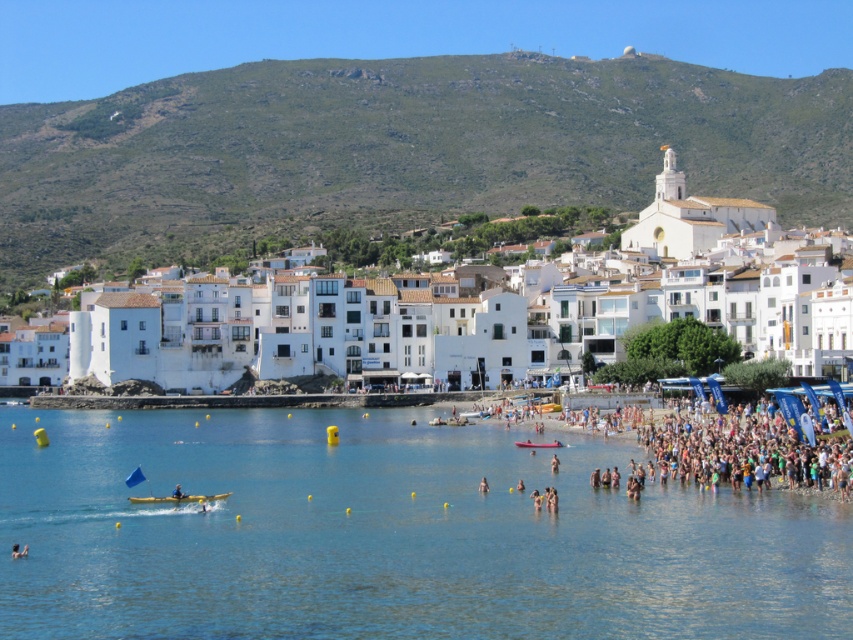
Is white plastic kayak at center thinner than pink rubber boat at center?

No.

Who is more distant from viewer, (224, 492) or (515, 444)?

Positioned behind is point (515, 444).

Image resolution: width=853 pixels, height=640 pixels. Describe the element at coordinates (178, 499) in the screenshot. I see `white plastic kayak at center` at that location.

What are the coordinates of `white plastic kayak at center` in the screenshot? It's located at (178, 499).

Does white plastic kayak at center come in front of skinny person at lower center?

Yes, it is.

Is white plastic kayak at center shorter than skinny person at lower center?

Correct, white plastic kayak at center is not as tall as skinny person at lower center.

Consider the image. Who is more distant from viewer, (x=209, y=496) or (x=485, y=490)?

The point (x=485, y=490) is behind.

At what (x,y) coordinates should I click in order to perform the action: click on white plastic kayak at center. Please return your answer as a coordinate pair (x, y). The image size is (853, 640). Looking at the image, I should click on (178, 499).

Which is more to the right, green grassy hillside at upper center or pink rubber boat at center?

pink rubber boat at center

Does green grassy hillside at upper center have a lesser width compared to pink rubber boat at center?

No, green grassy hillside at upper center is not thinner than pink rubber boat at center.

Is point (252, 202) less distant than point (538, 445)?

That is False.

The image size is (853, 640). I want to click on green grassy hillside at upper center, so click(402, 148).